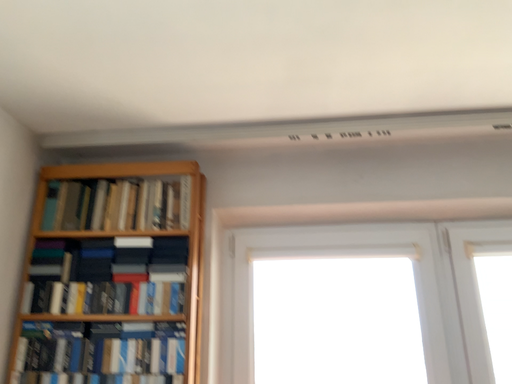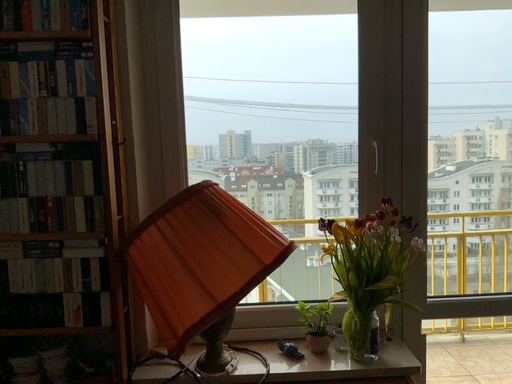
Question: How did the camera likely rotate when shooting the video?

Choices:
 (A) rotated downward
 (B) rotated upward

Answer: (A)